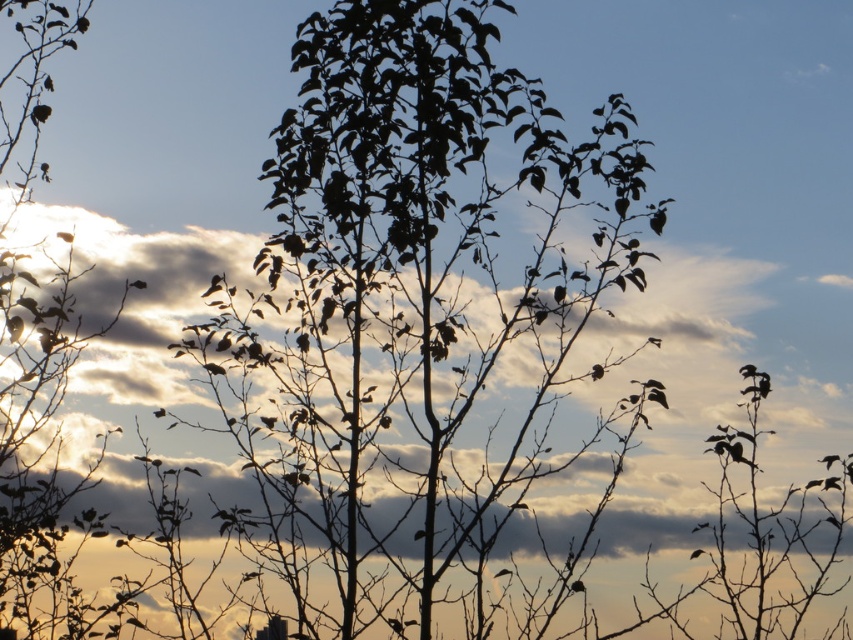
You are an artist planning to paint the scene. You want to ensure the silhouette leafy tree at center and the white fluffy cloud at upper center are proportionally accurate. Which object should you make wider in your painting?

The silhouette leafy tree at center should be made wider in the painting since its width surpasses that of the white fluffy cloud at upper center according to the description.

You are an artist trying to paint the scene. You notice the silhouette leafy tree at center and the white fluffy cloud at upper center. Which object should you draw first to ensure proper layering based on their sizes?

The silhouette leafy tree at center should be drawn first because it is larger than the white fluffy cloud at upper center, allowing you to layer the smaller cloud on top afterward.